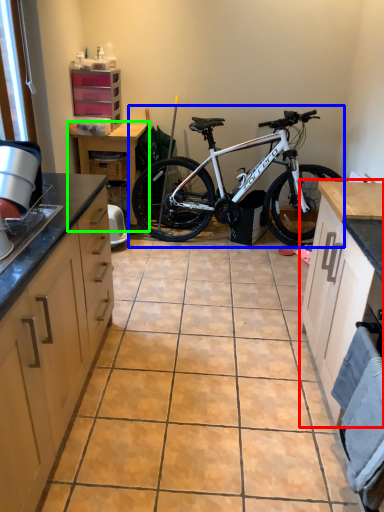
Question: Which is nearer to the cabinetry (highlighted by a red box)? bicycle (highlighted by a blue box) or table (highlighted by a green box).

Choices:
 (A) bicycle
 (B) table

Answer: (A)